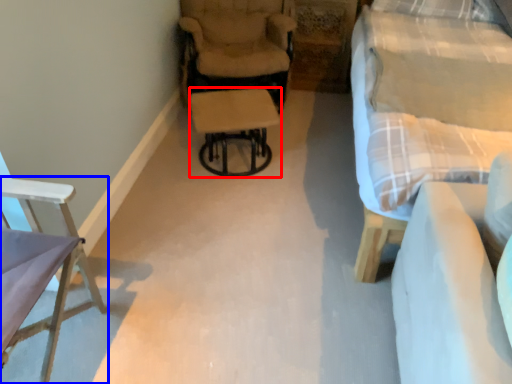
Question: Which point is closer to the camera, stool (highlighted by a red box) or chair (highlighted by a blue box)?

Choices:
 (A) stool
 (B) chair

Answer: (B)